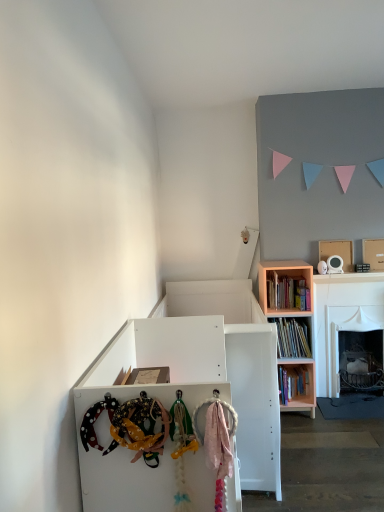
Question: From a real-world perspective, is pink matte bookshelf at upper right positioned under white cardboard box at upper right based on gravity?

Choices:
 (A) no
 (B) yes

Answer: (B)

Question: Is pink matte bookshelf at upper right positioned in front of white cardboard box at upper right?

Choices:
 (A) no
 (B) yes

Answer: (B)

Question: Is pink matte bookshelf at upper right at the right side of white cardboard box at upper right?

Choices:
 (A) no
 (B) yes

Answer: (A)

Question: From the image's perspective, does pink matte bookshelf at upper right appear higher than white cardboard box at upper right?

Choices:
 (A) yes
 (B) no

Answer: (B)

Question: Does pink matte bookshelf at upper right touch white cardboard box at upper right?

Choices:
 (A) yes
 (B) no

Answer: (B)

Question: Is pink matte bookshelf at upper right outside of white cardboard box at upper right?

Choices:
 (A) yes
 (B) no

Answer: (A)

Question: Is white cardboard box at upper right bigger than white matte cabinet at center?

Choices:
 (A) yes
 (B) no

Answer: (B)

Question: Is white cardboard box at upper right shorter than white matte cabinet at center?

Choices:
 (A) yes
 (B) no

Answer: (A)

Question: Does white cardboard box at upper right lie in front of white matte cabinet at center?

Choices:
 (A) no
 (B) yes

Answer: (A)

Question: Is white cardboard box at upper right positioned behind white matte cabinet at center?

Choices:
 (A) yes
 (B) no

Answer: (A)

Question: Is white cardboard box at upper right taller than white matte cabinet at center?

Choices:
 (A) yes
 (B) no

Answer: (B)

Question: Is white cardboard box at upper right smaller than white matte cabinet at center?

Choices:
 (A) yes
 (B) no

Answer: (A)

Question: Is white cardboard box at upper right located within white matte cabinet at center?

Choices:
 (A) yes
 (B) no

Answer: (B)